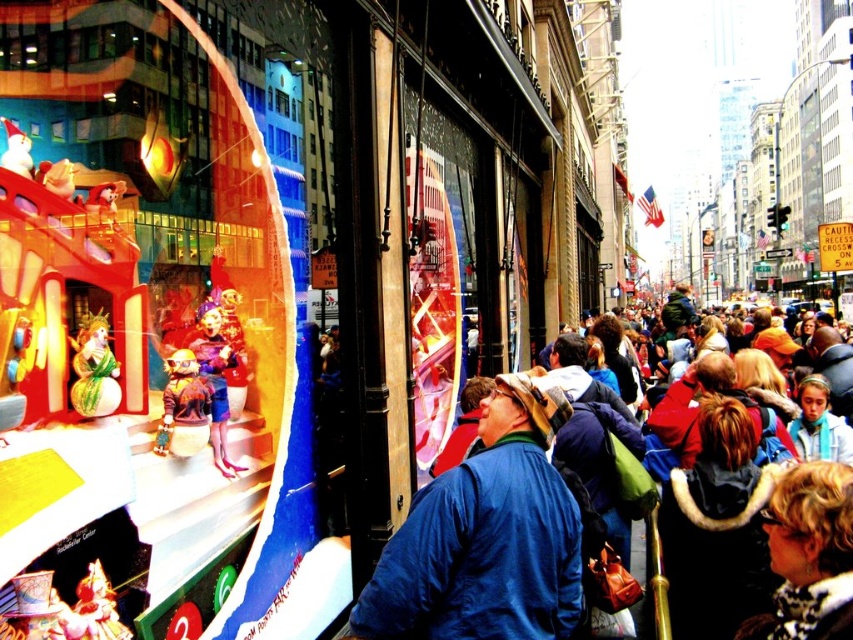
You are a window designer who wants to ensure all items in the display are visible to passersby. Given that the plush teddy bear at left and the shiny gold snowman at center are part of the display, which item might block the view of the other if placed incorrectly?

The plush teddy bear at left is taller than the shiny gold snowman at center, so if placed in front of the snowman, it could block its view. To ensure visibility, the shorter shiny gold snowman at center should be placed in front or at the same level as the taller plush teddy bear at left.

You are a delivery person who needs to place a package between the plush teddy bear at left and the matte green snowman at left in the window display. The package is 10 feet long. Will it fit between them?

The plush teddy bear at left and matte green snowman at left are 10.73 feet apart from each other. Since the package is 10 feet long, it will fit between them as there is enough space.